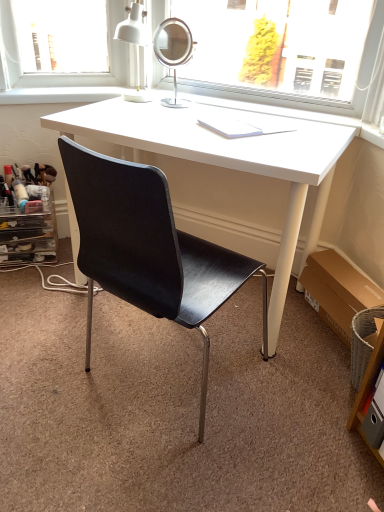
Question: Can you confirm if black leather chair at center is taller than white glossy desk at center?

Choices:
 (A) yes
 (B) no

Answer: (A)

Question: Considering the relative sizes of black leather chair at center and white glossy desk at center in the image provided, is black leather chair at center thinner than white glossy desk at center?

Choices:
 (A) yes
 (B) no

Answer: (A)

Question: From the image's perspective, is black leather chair at center beneath white glossy desk at center?

Choices:
 (A) yes
 (B) no

Answer: (A)

Question: Considering the relative positions of black leather chair at center and white glossy desk at center in the image provided, is black leather chair at center to the left of white glossy desk at center from the viewer's perspective?

Choices:
 (A) no
 (B) yes

Answer: (B)

Question: Does black leather chair at center have a larger size compared to white glossy desk at center?

Choices:
 (A) yes
 (B) no

Answer: (B)

Question: In terms of width, does white matte table lamp at upper center look wider or thinner when compared to brown cardboard box at lower right?

Choices:
 (A) wide
 (B) thin

Answer: (A)

Question: Considering the positions of white matte table lamp at upper center and brown cardboard box at lower right in the image, is white matte table lamp at upper center taller or shorter than brown cardboard box at lower right?

Choices:
 (A) tall
 (B) short

Answer: (A)

Question: From the image's perspective, relative to brown cardboard box at lower right, is white matte table lamp at upper center above or below?

Choices:
 (A) below
 (B) above

Answer: (B)

Question: Do you think white matte table lamp at upper center is within brown cardboard box at lower right, or outside of it?

Choices:
 (A) inside
 (B) outside

Answer: (B)

Question: From the image's perspective, is white paper at center above or below white matte table lamp at upper center?

Choices:
 (A) above
 (B) below

Answer: (B)

Question: In the image, is white paper at center positioned in front of or behind white matte table lamp at upper center?

Choices:
 (A) behind
 (B) front

Answer: (B)

Question: From their relative heights in the image, would you say white paper at center is taller or shorter than white matte table lamp at upper center?

Choices:
 (A) tall
 (B) short

Answer: (B)

Question: Is point (208, 117) positioned closer to the camera than point (135, 48)?

Choices:
 (A) closer
 (B) farther

Answer: (A)

Question: Is white matte table lamp at upper center taller or shorter than white paper at center?

Choices:
 (A) tall
 (B) short

Answer: (A)

Question: Looking at their shapes, would you say white matte table lamp at upper center is wider or thinner than white paper at center?

Choices:
 (A) wide
 (B) thin

Answer: (B)